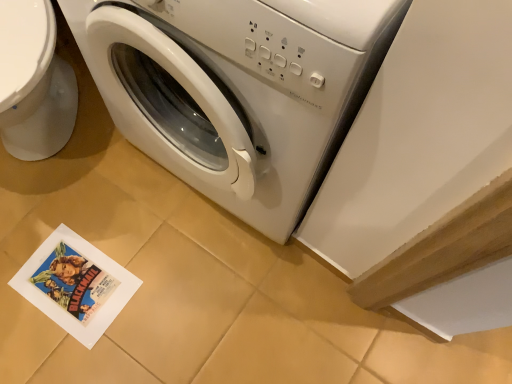
I want to click on free location in front of white glossy washing machine at center, so click(x=192, y=289).